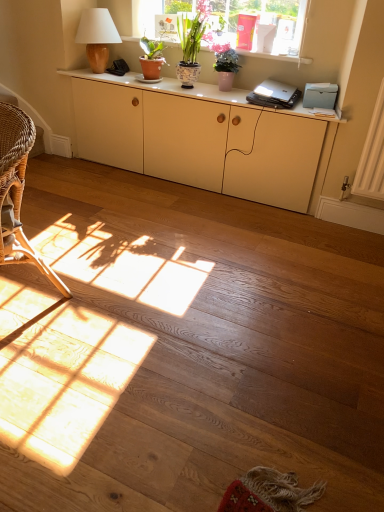
Find the location of `unoccupied space behind woven rattan chair at left`. unoccupied space behind woven rattan chair at left is located at coordinates (75, 249).